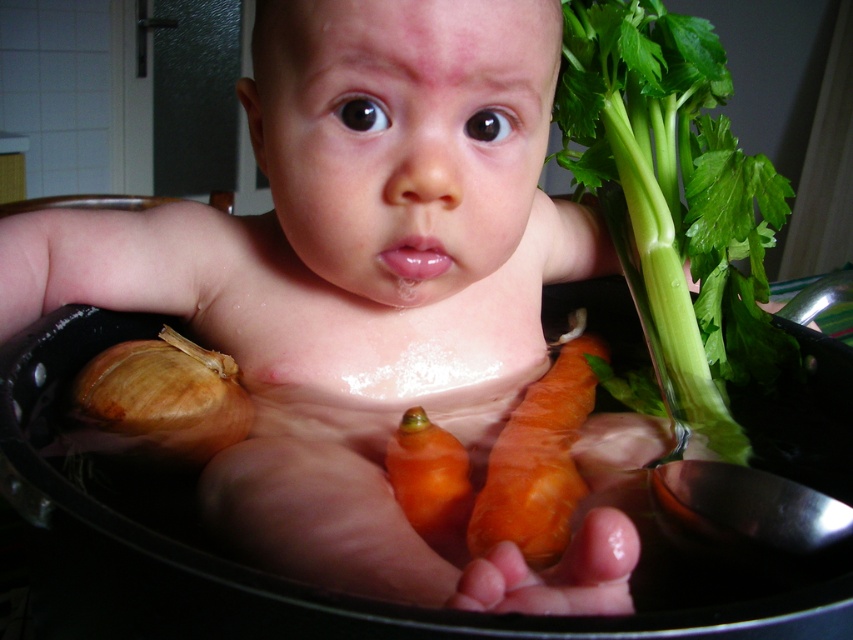
Is point (572, 365) less distant than point (434, 500)?

No, (572, 365) is behind (434, 500).

This screenshot has height=640, width=853. In order to click on orange smooth carrot at center in this screenshot , I will do `click(537, 461)`.

Who is shorter, green leafy material at upper right or brown matte onion at lower left?

brown matte onion at lower left is shorter.

Who is more distant from viewer, (688, 324) or (141, 355)?

Point (688, 324)

Which is in front, point (654, 330) or point (175, 346)?

Positioned in front is point (175, 346).

Find the location of a particular element. The width and height of the screenshot is (853, 640). green leafy material at upper right is located at coordinates (675, 200).

Does green leafy material at upper right have a greater height compared to orange smooth carrot at center?

Yes.

Is point (733, 166) closer to viewer compared to point (553, 563)?

No, (733, 166) is further to viewer.

Find the location of a particular element. The width and height of the screenshot is (853, 640). green leafy material at upper right is located at coordinates (675, 200).